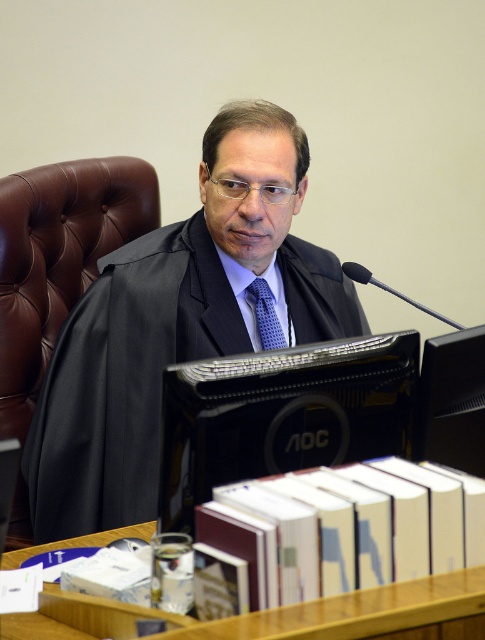
Does black matte business suit at center appear on the left side of blue dotted tie at center?

Indeed, black matte business suit at center is positioned on the left side of blue dotted tie at center.

Does point (302, 289) come in front of point (258, 292)?

No, it is not.

Locate an element on the screen. The image size is (485, 640). black matte business suit at center is located at coordinates (124, 378).

Consider the image. Does brown leather chair at left lie in front of wooden table at lower center?

That is False.

Does brown leather chair at left appear over wooden table at lower center?

Yes.

Where is `brown leather chair at left`? The image size is (485, 640). brown leather chair at left is located at coordinates (58, 259).

Can you confirm if black matte business suit at center is positioned below wooden table at lower center?

Incorrect, black matte business suit at center is not positioned below wooden table at lower center.

Between black matte business suit at center and wooden table at lower center, which one is positioned lower?

wooden table at lower center is below.

The width and height of the screenshot is (485, 640). Identify the location of black matte business suit at center. (124, 378).

You are a GUI agent. You are given a task and a screenshot of the screen. Output one action in this format:
    pyautogui.click(x=<x>, y=<y>)
    Task: Click on the black matte business suit at center
    This screenshot has width=485, height=640.
    Given the screenshot: What is the action you would take?
    pyautogui.click(x=124, y=378)